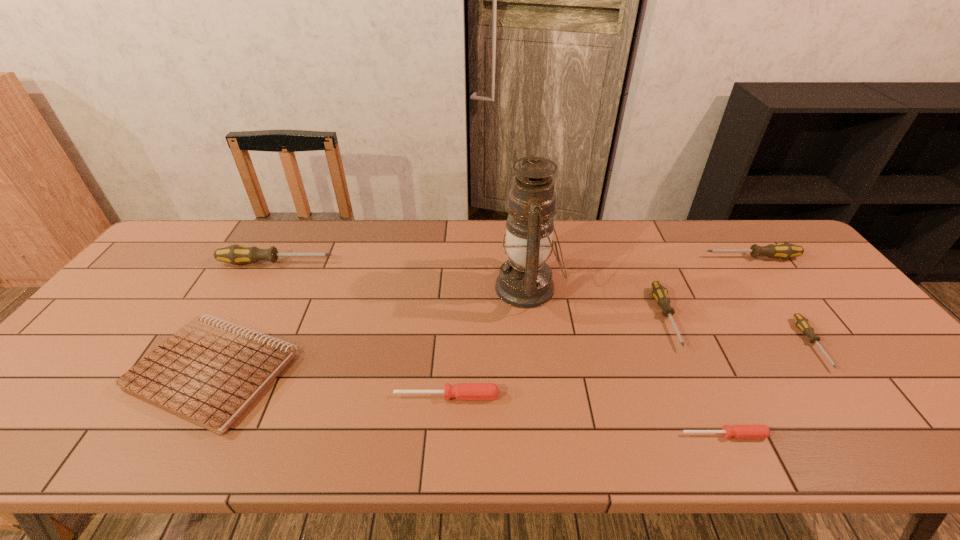
Where is `the bigger red screwdriver`? The width and height of the screenshot is (960, 540). the bigger red screwdriver is located at coordinates (463, 391).

At what (x,y) coordinates should I click in order to perform the action: click on the smallest gray screwdriver. Please return your answer as a coordinate pair (x, y). The image size is (960, 540). Looking at the image, I should click on (801, 322).

The height and width of the screenshot is (540, 960). I want to click on the shortest object, so click(x=739, y=431).

The image size is (960, 540). I want to click on the nearest screwdriver, so point(739,431).

The height and width of the screenshot is (540, 960). Identify the location of vacant space located on the back of the fifth object from right to left. (520, 224).

I want to click on vacant space located at the tip of the second tallest object, so click(453, 263).

Identify the location of vacant space located at the tip of the third tallest object. (615, 258).

At what (x,y) coordinates should I click in order to perform the action: click on vacant space situated 0.390m at the tip of the third tallest object. Please return your answer as a coordinate pair (x, y). Image resolution: width=960 pixels, height=540 pixels. Looking at the image, I should click on (x=580, y=258).

I want to click on free region located at the tip of the third tallest object, so click(589, 258).

This screenshot has width=960, height=540. I want to click on free point located at the tip of the third biggest gray screwdriver, so click(691, 375).